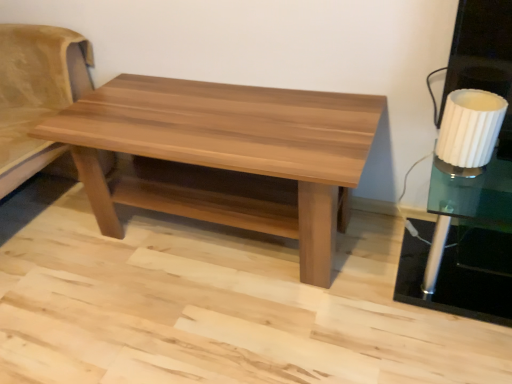
Question: Is suede beige futon at left in contact with white ribbed glass side table at right?

Choices:
 (A) yes
 (B) no

Answer: (B)

Question: From a real-world perspective, is suede beige futon at left on top of white ribbed glass side table at right?

Choices:
 (A) no
 (B) yes

Answer: (B)

Question: Is suede beige futon at left aimed at white ribbed glass side table at right?

Choices:
 (A) no
 (B) yes

Answer: (A)

Question: Does suede beige futon at left appear on the left side of white ribbed glass side table at right?

Choices:
 (A) no
 (B) yes

Answer: (B)

Question: Considering the relative sizes of suede beige futon at left and white ribbed glass side table at right in the image provided, is suede beige futon at left wider than white ribbed glass side table at right?

Choices:
 (A) yes
 (B) no

Answer: (A)

Question: From the image's perspective, is suede beige futon at left under white ribbed glass side table at right?

Choices:
 (A) yes
 (B) no

Answer: (B)

Question: Does white ribbed glass at right have a larger size compared to white ribbed glass side table at right?

Choices:
 (A) yes
 (B) no

Answer: (B)

Question: Is white ribbed glass at right not near white ribbed glass side table at right?

Choices:
 (A) no
 (B) yes

Answer: (A)

Question: Does white ribbed glass at right have a smaller size compared to white ribbed glass side table at right?

Choices:
 (A) yes
 (B) no

Answer: (A)

Question: Is the depth of white ribbed glass at right greater than that of white ribbed glass side table at right?

Choices:
 (A) yes
 (B) no

Answer: (A)

Question: Considering the relative sizes of white ribbed glass at right and white ribbed glass side table at right in the image provided, is white ribbed glass at right shorter than white ribbed glass side table at right?

Choices:
 (A) no
 (B) yes

Answer: (B)

Question: Is white ribbed glass at right oriented towards white ribbed glass side table at right?

Choices:
 (A) no
 (B) yes

Answer: (A)

Question: From the image's perspective, is white ribbed glass at right below suede beige futon at left?

Choices:
 (A) no
 (B) yes

Answer: (B)